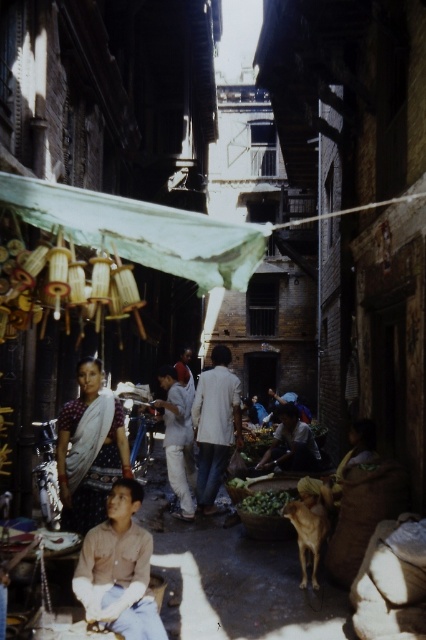
Does point (199, 404) come farther from viewer compared to point (183, 381)?

No.

Does light beige fabric coat at center have a greater height compared to light brown cotton shirt at center?

Yes, light beige fabric coat at center is taller than light brown cotton shirt at center.

What do you see at coordinates (215, 426) in the screenshot?
I see `light beige fabric coat at center` at bounding box center [215, 426].

You are a GUI agent. You are given a task and a screenshot of the screen. Output one action in this format:
    pyautogui.click(x=<x>, y=<y>)
    Task: Click on the light beige fabric coat at center
    The image size is (426, 640).
    Given the screenshot: What is the action you would take?
    pyautogui.click(x=215, y=426)

What do you see at coordinates (176, 438) in the screenshot? The width and height of the screenshot is (426, 640). I see `light blue fabric shirt at center` at bounding box center [176, 438].

Between point (181, 388) and point (186, 384), which one is positioned in front?

Positioned in front is point (181, 388).

Identify the location of light blue fabric shirt at center. (176, 438).

Which is above, light blue fabric shirt at center or green leafy vegetables at center?

Positioned higher is light blue fabric shirt at center.

Locate an element on the screen. The image size is (426, 640). light blue fabric shirt at center is located at coordinates (176, 438).